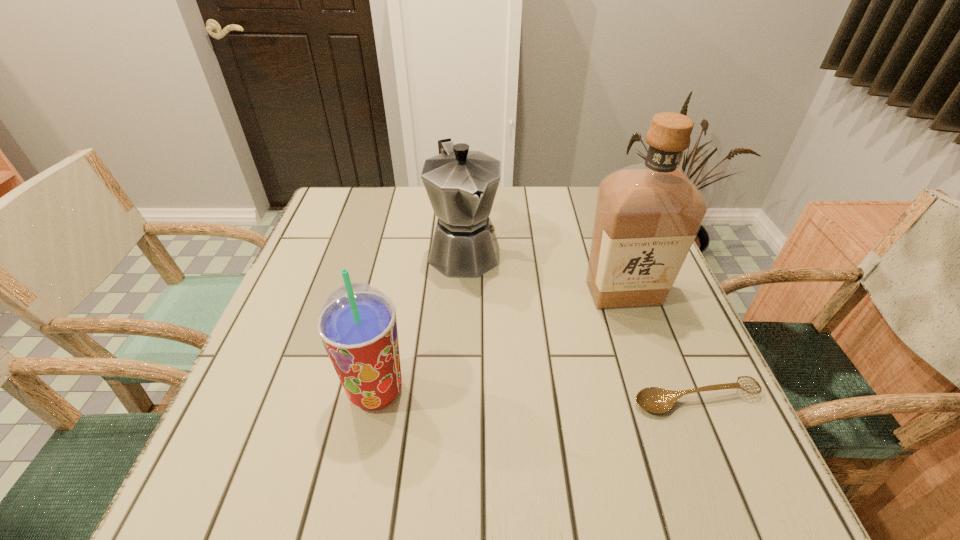
The width and height of the screenshot is (960, 540). Find the location of `the leftmost object`. the leftmost object is located at coordinates (357, 324).

The width and height of the screenshot is (960, 540). Find the location of `the shortest object`. the shortest object is located at coordinates (654, 399).

This screenshot has height=540, width=960. Identify the location of the third object from right to left. (461, 185).

Locate an element on the screen. This screenshot has height=540, width=960. liquor is located at coordinates (647, 215).

Identify the location of vacant space located on the right of the leftmost object. Image resolution: width=960 pixels, height=540 pixels. (463, 391).

Image resolution: width=960 pixels, height=540 pixels. I want to click on vacant space located on the back of the ladle, so click(x=653, y=295).

Locate an element on the screen. This screenshot has height=540, width=960. vacant space located at the spout of the second object from left to right is located at coordinates (519, 366).

Image resolution: width=960 pixels, height=540 pixels. Find the location of `vacant space located 0.200m at the spout of the second object from left to right`. vacant space located 0.200m at the spout of the second object from left to right is located at coordinates (508, 343).

Identify the location of vacant point located at the spout of the second object from left to right. (530, 386).

In order to click on free spot located on the front-facing side of the tallest object in this screenshot , I will do `click(598, 339)`.